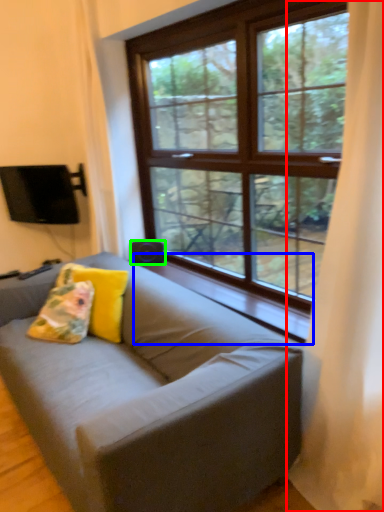
Question: Which object is positioned farthest from curtain (highlighted by a red box)? Select from window sill (highlighted by a blue box) and speaker (highlighted by a green box).

Choices:
 (A) window sill
 (B) speaker

Answer: (B)